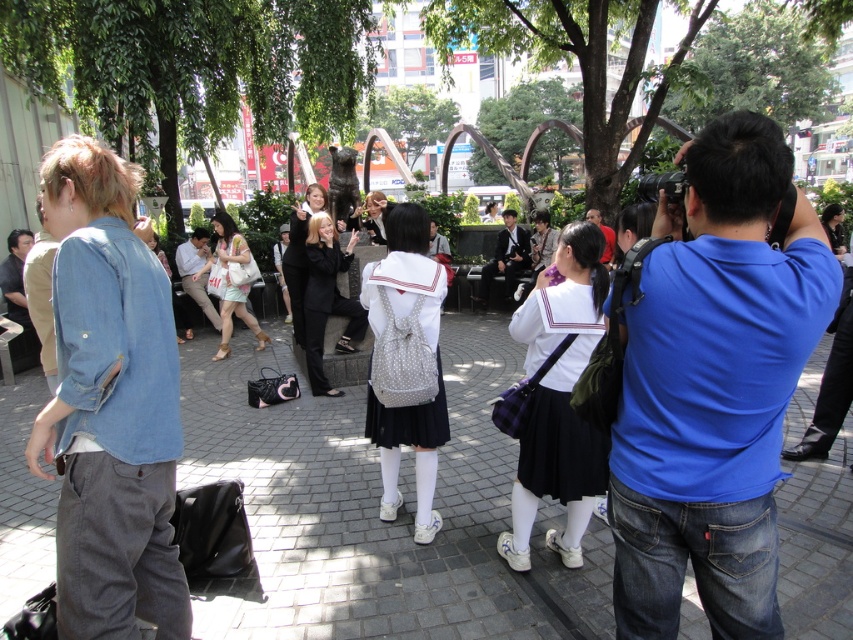
You are standing at the center of the square and want to find the denim jacket at left. According to the coordinates provided, in which direction should you walk to reach it?

The denim jacket at left is located at coordinates point (x=109, y=404). Since you are at the center, you should walk to the left and slightly forward to reach it.

You are standing at the center of the square and want to go to the denim jacket at left. Which direction should you move in?

You should move to the left to reach the denim jacket at left since it is located at point (109,404) which is to the left of the center.